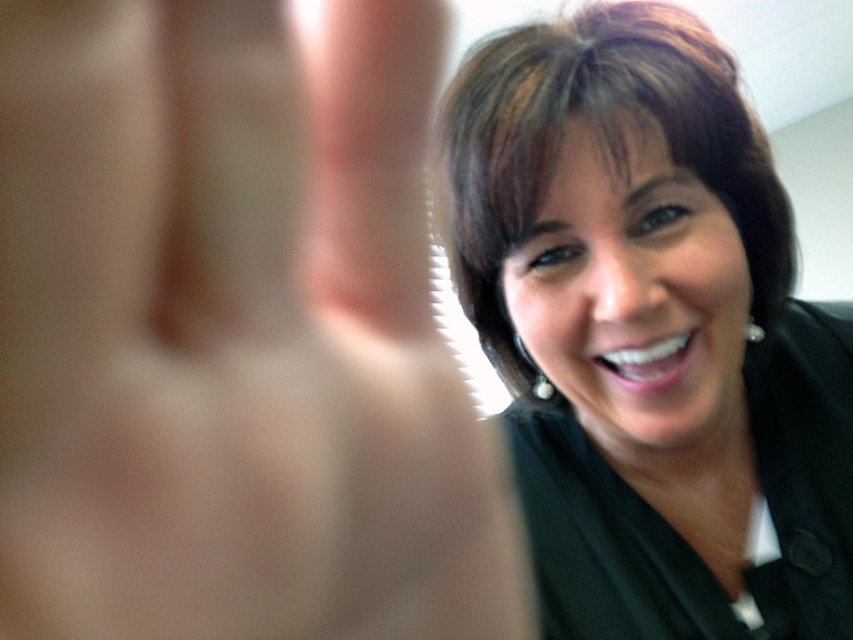
You are taking a photo of a person with short brown hair and want to focus on two specific points on their face. The first point is at coordinate point (33, 634) and the second is at point (659, 116). Which point should you focus on to ensure it appears sharper in the photo?

Point (33, 634) is closer to the camera than point (659, 116), so focusing on point (33, 634) will make it appear sharper in the photo.

Based on the scene description, where is the smooth skin hand at center located in the image?

The smooth skin hand at center is located at point coordinates of (231, 336).

You are a photographer trying to adjust the focus of your camera. You want to ensure both the smooth skin hand at center and the brown shiny hair at upper right are in focus. However, your camera can only focus on the object that takes up more space in the frame. Which object should you focus on?

The brown shiny hair at upper right takes up more space in the frame than the smooth skin hand at center, so you should focus on the brown shiny hair at upper right to ensure it is in focus.